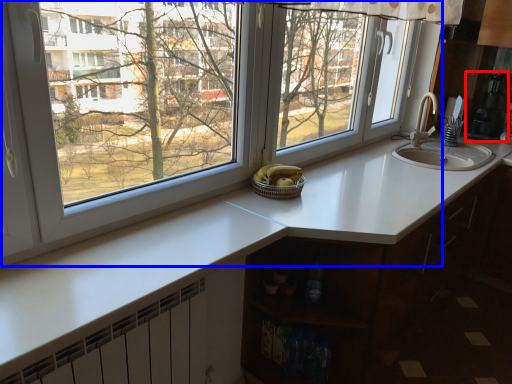
Question: Which object is closer to the camera taking this photo, appliance (highlighted by a red box) or window (highlighted by a blue box)?

Choices:
 (A) appliance
 (B) window

Answer: (B)